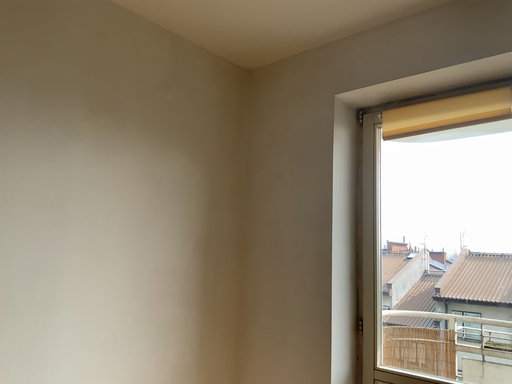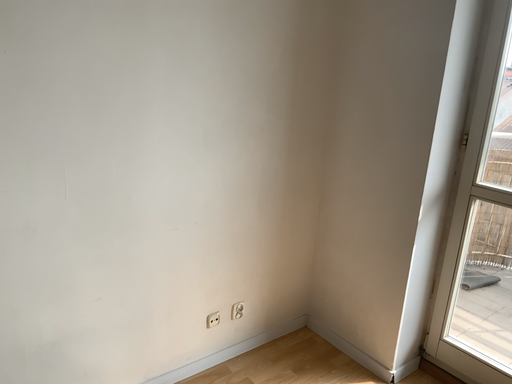
Question: How did the camera likely rotate when shooting the video?

Choices:
 (A) rotated right
 (B) rotated left

Answer: (B)